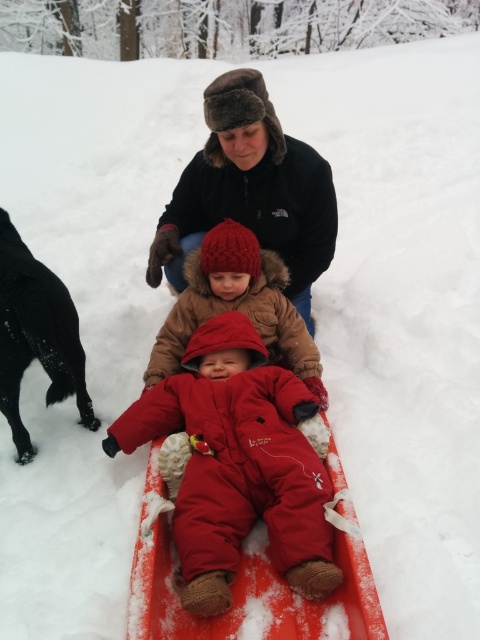
Question: Which point appears closest to the camera in this image?

Choices:
 (A) (160, 362)
 (B) (211, 108)

Answer: (B)

Question: Is black fur-lined hat at upper center to the left of red fuzzy hat at center from the viewer's perspective?

Choices:
 (A) no
 (B) yes

Answer: (A)

Question: Which point is farther to the camera?

Choices:
 (A) (238, 125)
 (B) (254, 515)
 (C) (28, 292)

Answer: (A)

Question: Observing the image, what is the correct spatial positioning of black fur-lined hat at upper center in reference to black fur dog at left?

Choices:
 (A) above
 (B) below

Answer: (A)

Question: Is black fur-lined hat at upper center smaller than black fur dog at left?

Choices:
 (A) no
 (B) yes

Answer: (A)

Question: Which point is closer to the camera?

Choices:
 (A) black fur dog at left
 (B) red fuzzy hat at center
 (C) matte red snowsuit at center

Answer: (C)